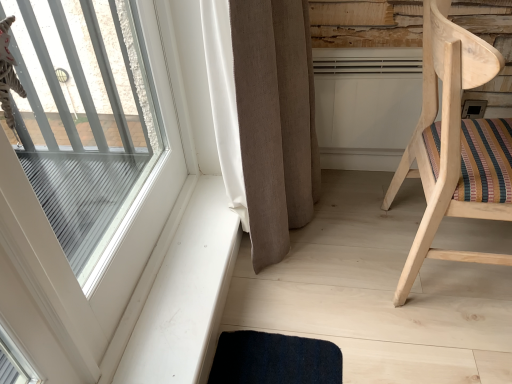
Question: From the image's perspective, is clear glass window at upper left above white smooth window sill at lower left?

Choices:
 (A) no
 (B) yes

Answer: (B)

Question: Could you tell me if clear glass window at upper left is turned towards white smooth window sill at lower left?

Choices:
 (A) yes
 (B) no

Answer: (B)

Question: Can you confirm if clear glass window at upper left is wider than white smooth window sill at lower left?

Choices:
 (A) no
 (B) yes

Answer: (A)

Question: Would you consider clear glass window at upper left to be distant from white smooth window sill at lower left?

Choices:
 (A) yes
 (B) no

Answer: (B)

Question: Is clear glass window at upper left thinner than white smooth window sill at lower left?

Choices:
 (A) no
 (B) yes

Answer: (B)

Question: Does clear glass window at upper left have a greater height compared to white smooth window sill at lower left?

Choices:
 (A) yes
 (B) no

Answer: (A)

Question: From a real-world perspective, is beige fabric curtain at center over white smooth window sill at lower left?

Choices:
 (A) no
 (B) yes

Answer: (B)

Question: Is beige fabric curtain at center facing towards white smooth window sill at lower left?

Choices:
 (A) yes
 (B) no

Answer: (B)

Question: From the image's perspective, is beige fabric curtain at center over white smooth window sill at lower left?

Choices:
 (A) yes
 (B) no

Answer: (A)

Question: Considering the relative positions of beige fabric curtain at center and white smooth window sill at lower left in the image provided, is beige fabric curtain at center to the left of white smooth window sill at lower left from the viewer's perspective?

Choices:
 (A) yes
 (B) no

Answer: (B)

Question: Is beige fabric curtain at center not within white smooth window sill at lower left?

Choices:
 (A) yes
 (B) no

Answer: (A)

Question: Considering the relative sizes of beige fabric curtain at center and white smooth window sill at lower left in the image provided, is beige fabric curtain at center thinner than white smooth window sill at lower left?

Choices:
 (A) yes
 (B) no

Answer: (B)

Question: Could you tell me if clear glass window at upper left is turned towards beige fabric curtain at center?

Choices:
 (A) yes
 (B) no

Answer: (A)